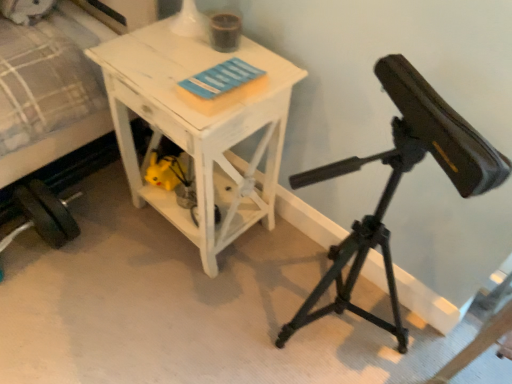
Question: From the image's perspective, is white fabric bed at left above or below white distressed wood table at center?

Choices:
 (A) below
 (B) above

Answer: (B)

Question: Based on their positions, is white fabric bed at left located to the left or right of white distressed wood table at center?

Choices:
 (A) right
 (B) left

Answer: (B)

Question: Considering the real-world distances, which object is closest to the white distressed wood table at center?

Choices:
 (A) white fabric bed at left
 (B) black matte tripod at right

Answer: (A)

Question: Considering the real-world distances, which object is closest to the black matte tripod at right?

Choices:
 (A) white distressed wood table at center
 (B) white fabric bed at left

Answer: (A)